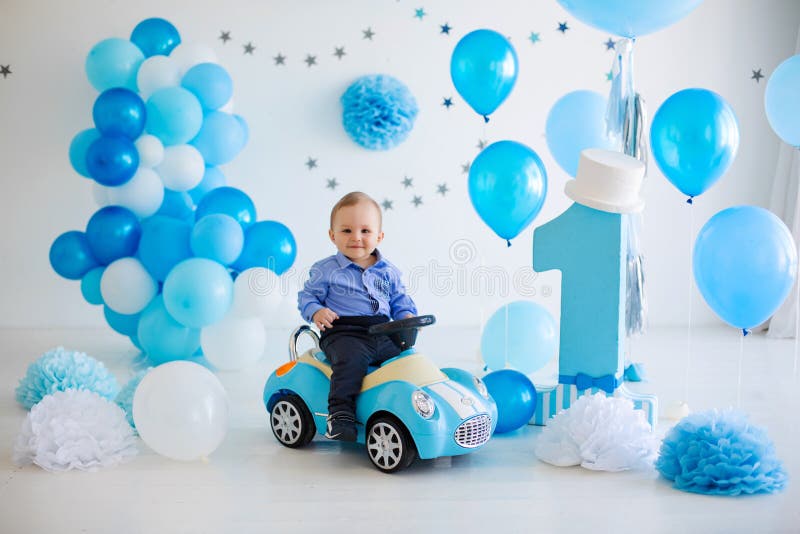
In order to click on toy car in this screenshot , I will do `click(446, 412)`.